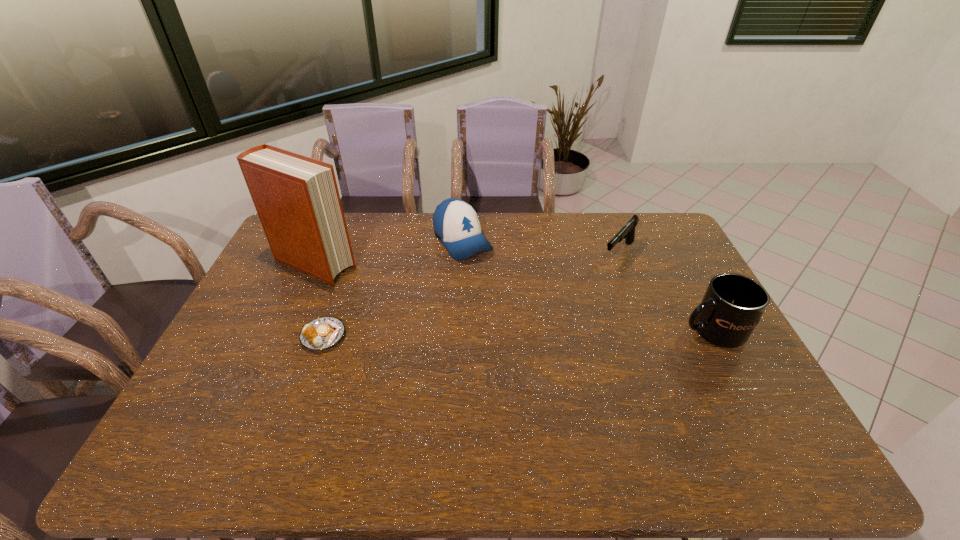
Identify the location of the shortest object. (321, 333).

At what (x,y) coordinates should I click in order to perform the action: click on the rightmost object. Please return your answer as a coordinate pair (x, y). Image resolution: width=960 pixels, height=540 pixels. Looking at the image, I should click on pyautogui.click(x=732, y=306).

Where is `baseball cap`? baseball cap is located at coordinates (456, 224).

Identify the location of hardback book. (297, 200).

Image resolution: width=960 pixels, height=540 pixels. Identify the location of the second shortest object. (627, 232).

Image resolution: width=960 pixels, height=540 pixels. I want to click on the second object from right to left, so click(627, 232).

At what (x,y) coordinates should I click in order to perform the action: click on vacant region located 0.240m on the right of the shortest object. Please return your answer as a coordinate pair (x, y). Image resolution: width=960 pixels, height=540 pixels. Looking at the image, I should click on (429, 336).

Find the location of a particular element. The width and height of the screenshot is (960, 540). free spot located 0.170m with the handle on the side of the mug is located at coordinates (620, 331).

Locate an element on the screen. The image size is (960, 540). vacant point located with the handle on the side of the mug is located at coordinates (631, 331).

The image size is (960, 540). Identify the location of free region located 0.090m with the handle on the side of the mug. click(x=648, y=331).